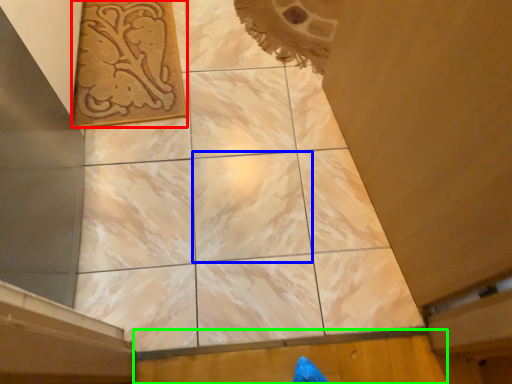
Question: Based on their relative distances, which object is nearer to design (highlighted by a red box)? Choose from tile (highlighted by a blue box) and plywood (highlighted by a green box).

Choices:
 (A) tile
 (B) plywood

Answer: (A)